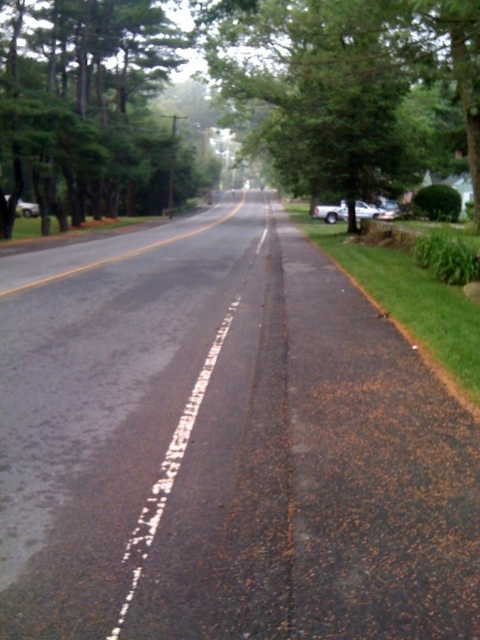
Between green leafy tree at center and green leafy tree at left, which one is positioned higher?

green leafy tree at left

Who is positioned more to the right, green leafy tree at center or green leafy tree at left?

green leafy tree at center is more to the right.

Between point (475, 161) and point (24, 13), which one is positioned in front?

Point (475, 161) is in front.

I want to click on green leafy tree at center, so click(x=352, y=84).

Does green leafy tree at left have a larger size compared to white dashed line at center?

Yes.

Does green leafy tree at left appear over white dashed line at center?

Yes, green leafy tree at left is above white dashed line at center.

Which is behind, point (82, 214) or point (182, 448)?

Positioned behind is point (82, 214).

You are a GUI agent. You are given a task and a screenshot of the screen. Output one action in this format:
    pyautogui.click(x=<x>, y=<y>)
    Task: Click on the green leafy tree at left
    
    Given the screenshot: What is the action you would take?
    pyautogui.click(x=84, y=108)

Who is taller, green leafy tree at center or white dashed line at center?

green leafy tree at center

Does point (414, 12) come in front of point (132, 572)?

That is False.

Between point (296, 189) and point (213, 356), which one is positioned behind?

Positioned behind is point (296, 189).

In order to click on green leafy tree at center in this screenshot , I will do `click(352, 84)`.